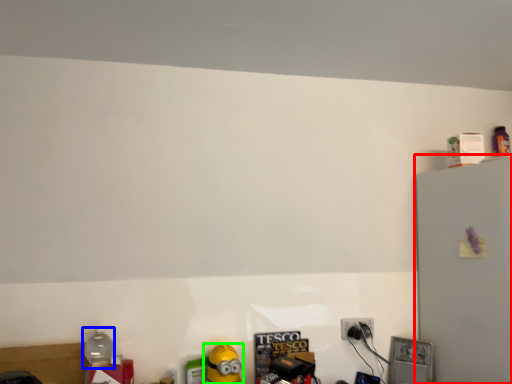
Question: Considering the real-world distances, which object is closest to fridge (highlighted by a red box)? bottle (highlighted by a blue box) or toy (highlighted by a green box).

Choices:
 (A) bottle
 (B) toy

Answer: (B)